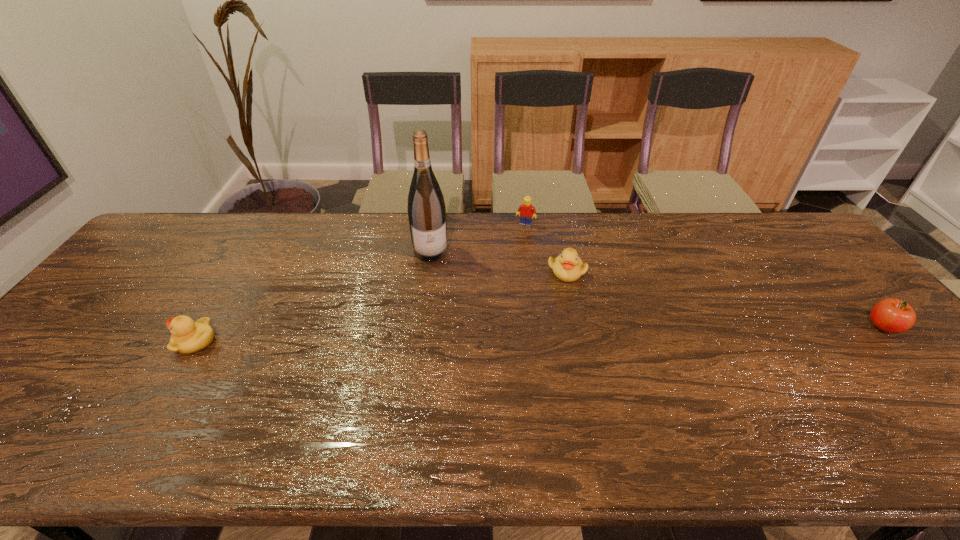
You are a GUI agent. You are given a task and a screenshot of the screen. Output one action in this format:
    pyautogui.click(x=<x>, y=<y>)
    Task: Click on the vacant area situated at the face of the nearer duckling
    The height and width of the screenshot is (540, 960).
    Given the screenshot: What is the action you would take?
    click(x=84, y=341)

Find the location of a particular element. This screenshot has height=540, width=960. free space located at the face of the nearer duckling is located at coordinates (73, 341).

Locate an element on the screen. Image resolution: width=960 pixels, height=540 pixels. vacant space located 0.390m on the back of the rightmost object is located at coordinates (795, 230).

Find the location of a particular element. Image resolution: width=960 pixels, height=540 pixels. vacant space located on the label of the tallest object is located at coordinates (450, 357).

Identify the location of vacant space positioned on the label of the tallest object. The width and height of the screenshot is (960, 540). pos(446,335).

The width and height of the screenshot is (960, 540). I want to click on free location located 0.210m on the label of the tallest object, so click(x=442, y=310).

What are the coordinates of `blank space located 0.230m on the beak of the fourth object from left to right` in the screenshot? It's located at (497, 318).

Find the location of `vacant space located on the beak of the fourth object from left to right`. vacant space located on the beak of the fourth object from left to right is located at coordinates (508, 310).

You are a GUI agent. You are given a task and a screenshot of the screen. Output one action in this format:
    pyautogui.click(x=<x>, y=<y>)
    Task: Click on the vacant space located 0.070m on the beak of the fourth object from left to right
    This screenshot has width=960, height=540.
    Given the screenshot: What is the action you would take?
    pyautogui.click(x=538, y=291)

Find the location of a particular element. The width and height of the screenshot is (960, 540). vacant space positioned 0.310m on the front-facing side of the farthest object is located at coordinates (501, 288).